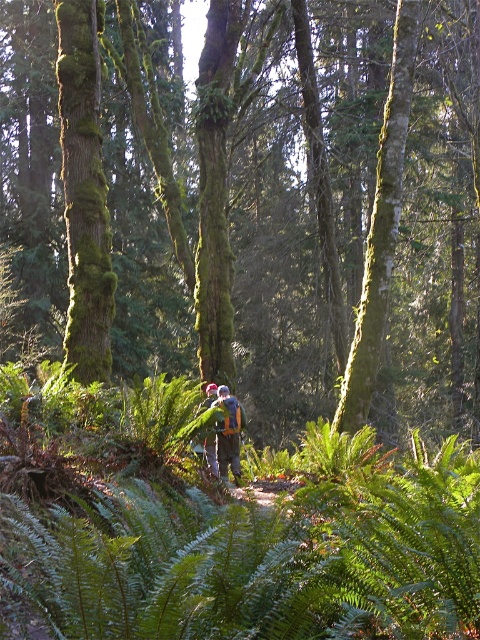
Does point (206, 380) come farther from viewer compared to point (220, 387)?

Yes, it is behind point (220, 387).

Can you confirm if green mossy tree at center is positioned to the right of camouflage fabric backpack at center?

No, green mossy tree at center is not to the right of camouflage fabric backpack at center.

Is point (437, 387) farther from viewer compared to point (239, 404)?

Yes, it is behind point (239, 404).

Locate an element on the screen. green mossy tree at center is located at coordinates (164, 208).